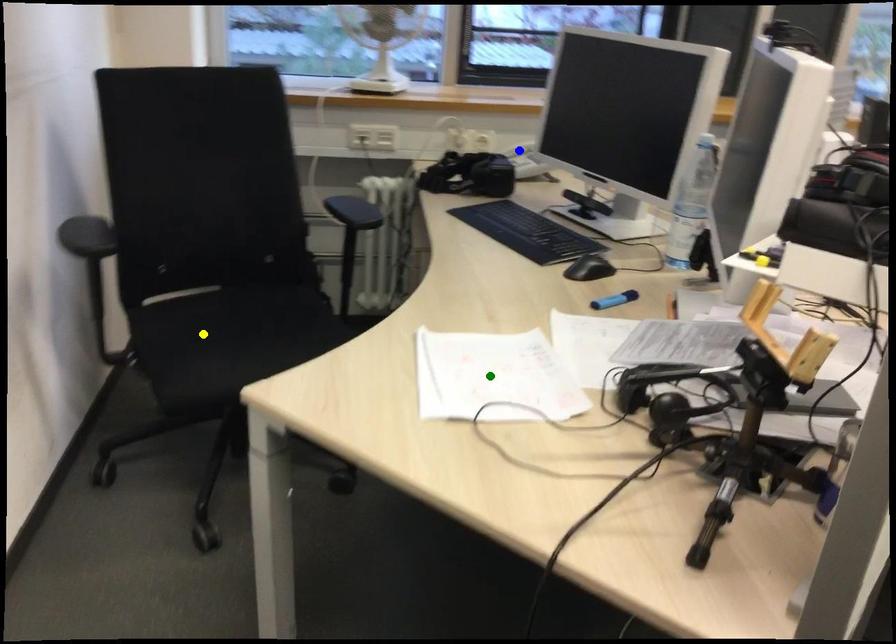
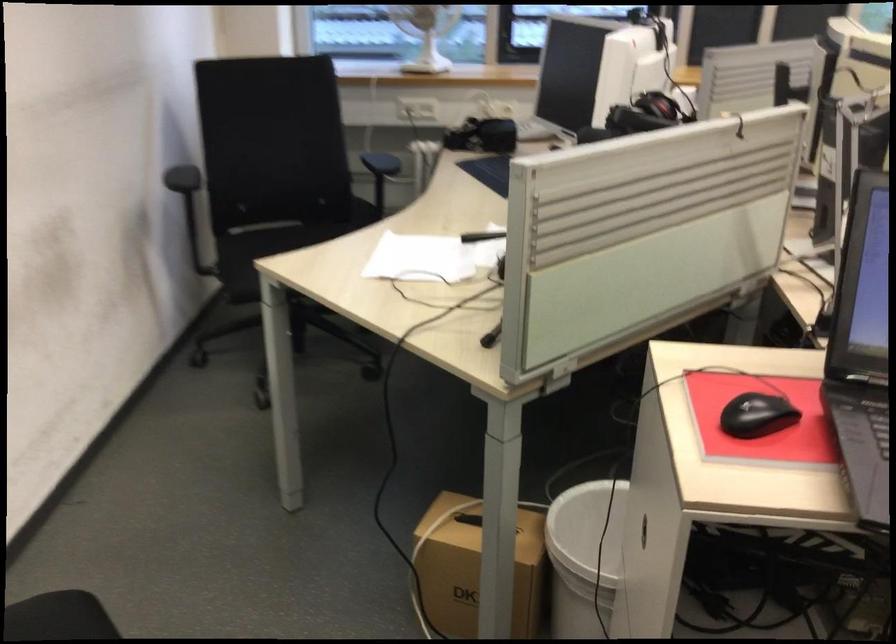
I am providing you with two images of the same scene from different viewpoints. Three points are marked in image1. Which point corresponds to a part or object that is occluded in image2?In image1, three points are marked. Which of them correspond to a part or object that is occluded in image2?Among the three points shown in image1, which one corresponds to a part or object that is no longer visible due to occlusion in image2?

blue point